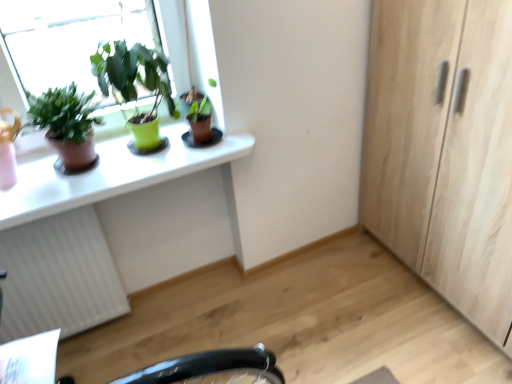
Question: Is white textured radiator at lower left at the left side of white glossy desk at upper left?

Choices:
 (A) yes
 (B) no

Answer: (A)

Question: Is white textured radiator at lower left oriented away from white glossy desk at upper left?

Choices:
 (A) no
 (B) yes

Answer: (A)

Question: Does white textured radiator at lower left appear on the right side of white glossy desk at upper left?

Choices:
 (A) yes
 (B) no

Answer: (B)

Question: Can you confirm if white textured radiator at lower left is shorter than white glossy desk at upper left?

Choices:
 (A) no
 (B) yes

Answer: (A)

Question: From the image's perspective, is white textured radiator at lower left beneath white glossy desk at upper left?

Choices:
 (A) yes
 (B) no

Answer: (A)

Question: From their relative heights in the image, would you say matte brown pot at upper center, which ranks as the 1th houseplant in right-to-left order, is taller or shorter than white glossy desk at upper left?

Choices:
 (A) short
 (B) tall

Answer: (B)

Question: Is matte brown pot at upper center, which ranks as the 1th houseplant in right-to-left order, in front of or behind white glossy desk at upper left in the image?

Choices:
 (A) front
 (B) behind

Answer: (B)

Question: In terms of width, does matte brown pot at upper center, which ranks as the 3th houseplant in left-to-right order, look wider or thinner when compared to white glossy desk at upper left?

Choices:
 (A) thin
 (B) wide

Answer: (A)

Question: Is matte brown pot at upper center, which ranks as the 3th houseplant in left-to-right order, inside or outside of white glossy desk at upper left?

Choices:
 (A) outside
 (B) inside

Answer: (A)

Question: Considering the positions of white glossy desk at upper left and white textured radiator at lower left in the image, is white glossy desk at upper left bigger or smaller than white textured radiator at lower left?

Choices:
 (A) big
 (B) small

Answer: (B)

Question: Is white glossy desk at upper left inside or outside of white textured radiator at lower left?

Choices:
 (A) inside
 (B) outside

Answer: (B)

Question: Is white glossy desk at upper left in front of or behind white textured radiator at lower left in the image?

Choices:
 (A) front
 (B) behind

Answer: (A)

Question: From the image's perspective, is white glossy desk at upper left above or below white textured radiator at lower left?

Choices:
 (A) above
 (B) below

Answer: (A)

Question: Considering the positions of point (204, 165) and point (93, 69), is point (204, 165) closer or farther from the camera than point (93, 69)?

Choices:
 (A) farther
 (B) closer

Answer: (A)

Question: Based on their sizes in the image, would you say white glossy desk at upper left is bigger or smaller than green matte pot at upper left, the second houseplant positioned from the right?

Choices:
 (A) small
 (B) big

Answer: (B)